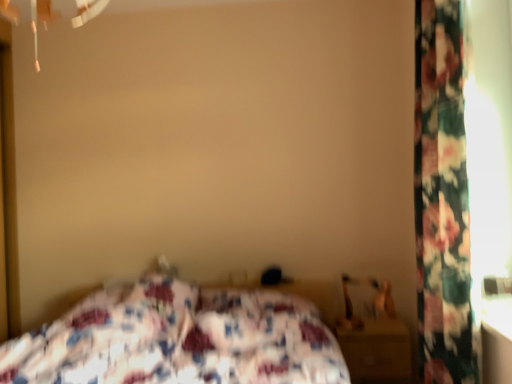
Question: Is floral fabric bed at center surrounding floral fabric curtain at right?

Choices:
 (A) yes
 (B) no

Answer: (B)

Question: From a real-world perspective, is floral fabric bed at center under floral fabric curtain at right?

Choices:
 (A) yes
 (B) no

Answer: (A)

Question: Is floral fabric bed at center positioned behind floral fabric curtain at right?

Choices:
 (A) yes
 (B) no

Answer: (B)

Question: Can we say floral fabric bed at center lies outside floral fabric curtain at right?

Choices:
 (A) yes
 (B) no

Answer: (A)

Question: Does floral fabric bed at center have a greater height compared to floral fabric curtain at right?

Choices:
 (A) yes
 (B) no

Answer: (B)

Question: Considering their positions, is wooden nightstand at lower right located in front of or behind floral fabric curtain at right?

Choices:
 (A) behind
 (B) front

Answer: (A)

Question: Is point click(x=373, y=326) closer or farther from the camera than point click(x=440, y=26)?

Choices:
 (A) farther
 (B) closer

Answer: (A)

Question: In terms of height, does wooden nightstand at lower right look taller or shorter compared to floral fabric curtain at right?

Choices:
 (A) tall
 (B) short

Answer: (B)

Question: Is wooden nightstand at lower right wider or thinner than floral fabric curtain at right?

Choices:
 (A) thin
 (B) wide

Answer: (B)

Question: Relative to floral fabric bed at center, is floral fabric curtain at right in front or behind?

Choices:
 (A) front
 (B) behind

Answer: (B)

Question: From a real-world perspective, relative to floral fabric bed at center, is floral fabric curtain at right vertically above or below?

Choices:
 (A) above
 (B) below

Answer: (A)

Question: Does point (441, 271) appear closer or farther from the camera than point (87, 365)?

Choices:
 (A) closer
 (B) farther

Answer: (A)

Question: Looking at the image, does floral fabric curtain at right seem bigger or smaller compared to floral fabric bed at center?

Choices:
 (A) small
 (B) big

Answer: (A)

Question: From a real-world perspective, is wooden nightstand at lower right physically located above or below floral fabric bed at center?

Choices:
 (A) below
 (B) above

Answer: (A)

Question: Is wooden nightstand at lower right bigger or smaller than floral fabric bed at center?

Choices:
 (A) small
 (B) big

Answer: (A)